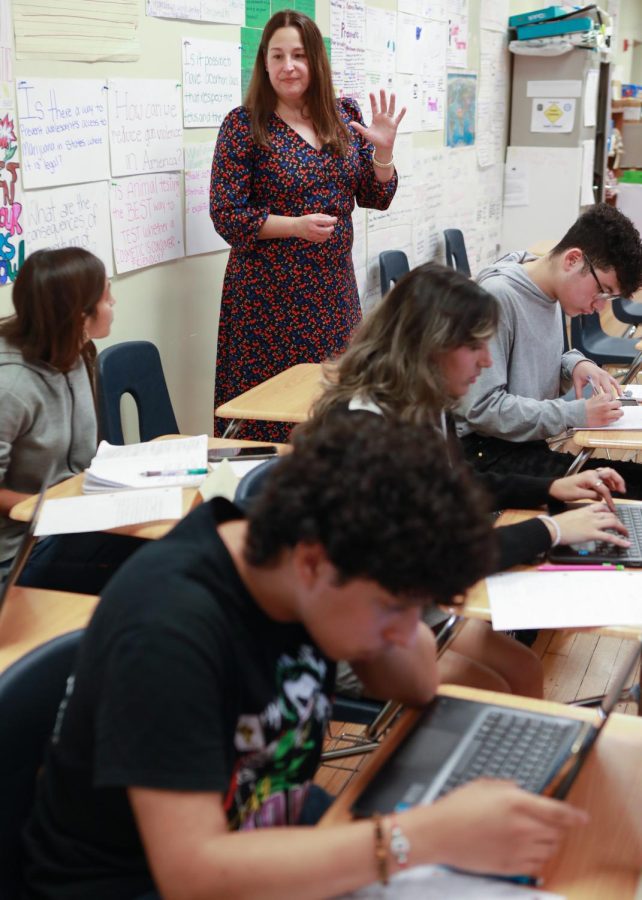
This screenshot has height=900, width=642. Find the location of `pens`. pens is located at coordinates (178, 473), (585, 564), (594, 389).